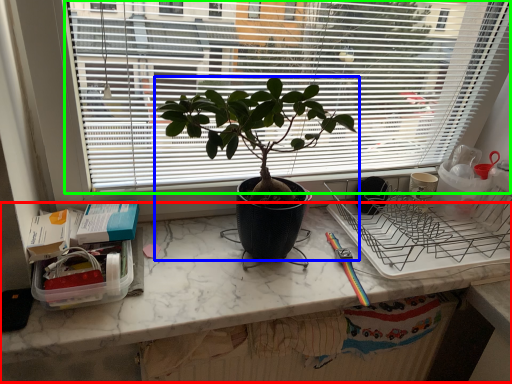
Question: Which object is positioned closest to computer desk (highlighted by a red box)? Select from houseplant (highlighted by a blue box) and window (highlighted by a green box).

Choices:
 (A) houseplant
 (B) window

Answer: (A)